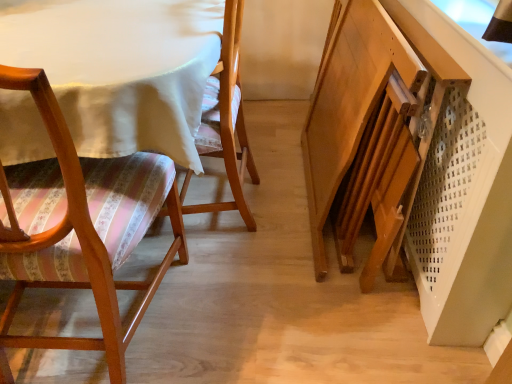
Question: From the image's perspective, is wooden floral-patterned chair at left, which ranks as the second chair in left-to-right order, positioned above or below matte wood chair at left, which appears as the first chair when viewed from the left?

Choices:
 (A) above
 (B) below

Answer: (A)

Question: Is point 220,125 positioned closer to the camera than point 65,281?

Choices:
 (A) farther
 (B) closer

Answer: (A)

Question: From their relative heights in the image, would you say wooden floral-patterned chair at left, which ranks as the second chair in left-to-right order, is taller or shorter than matte wood chair at left, which appears as the first chair when viewed from the left?

Choices:
 (A) short
 (B) tall

Answer: (A)

Question: Relative to wooden floral-patterned chair at left, the 1th chair viewed from the right, is matte wood chair at left, the second chair from the right, in front or behind?

Choices:
 (A) behind
 (B) front

Answer: (B)

Question: Considering the relative positions of matte wood chair at left, which appears as the first chair when viewed from the left, and wooden floral-patterned chair at left, the 1th chair viewed from the right, in the image provided, is matte wood chair at left, which appears as the first chair when viewed from the left, to the left or to the right of wooden floral-patterned chair at left, the 1th chair viewed from the right,?

Choices:
 (A) left
 (B) right

Answer: (A)

Question: Is matte wood chair at left, which appears as the first chair when viewed from the left, bigger or smaller than wooden floral-patterned chair at left, the 1th chair viewed from the right?

Choices:
 (A) big
 (B) small

Answer: (A)

Question: From a real-world perspective, is matte wood chair at left, which appears as the first chair when viewed from the left, above or below wooden floral-patterned chair at left, which ranks as the second chair in left-to-right order?

Choices:
 (A) above
 (B) below

Answer: (A)